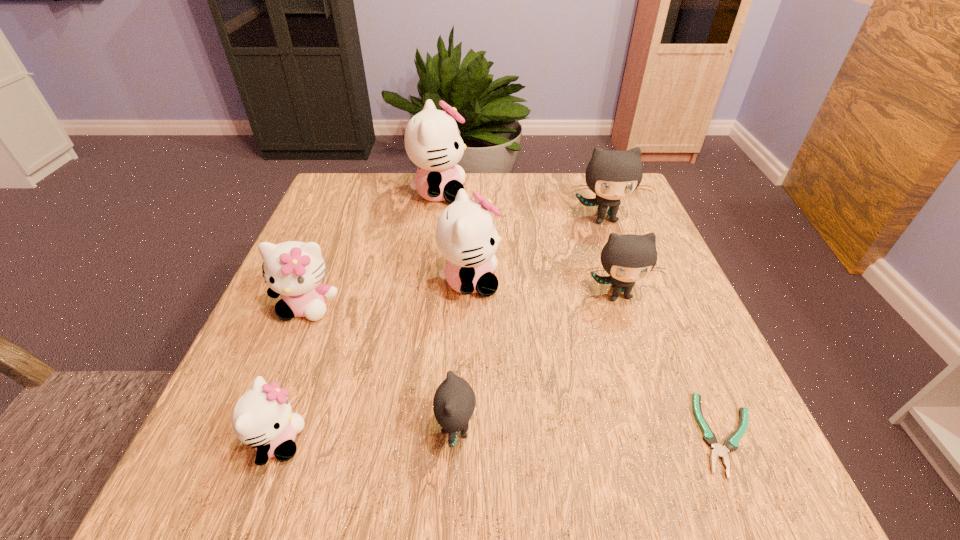
Where is `white kitten object that ranks as the closest to the third biggest white kitten`? The width and height of the screenshot is (960, 540). white kitten object that ranks as the closest to the third biggest white kitten is located at coordinates (262, 417).

The width and height of the screenshot is (960, 540). What are the coordinates of `the closest white kitten relative to the nearest white kitten` in the screenshot? It's located at (294, 269).

Locate an element on the screen. gray kitten that is the closest to the third biggest white kitten is located at coordinates (454, 402).

Identify which gray kitten is the nearest to the teal pliers. Please provide its 2D coordinates. Your answer should be formatted as a tuple, i.e. [(x, y)], where the tuple contains the x and y coordinates of a point satisfying the conditions above.

[(627, 258)]

This screenshot has height=540, width=960. Identify the location of free space that satisfies the following two spatial constraints: 1. on the front-facing side of the biggest gray kitten; 2. on the right side of the shortest object. [683, 434].

Find the location of `free point that satisfies the following two spatial constraints: 1. on the front-facing side of the farthest gray kitten; 2. on the front-facing side of the second biggest white kitten`. free point that satisfies the following two spatial constraints: 1. on the front-facing side of the farthest gray kitten; 2. on the front-facing side of the second biggest white kitten is located at coordinates (627, 281).

Locate an element on the screen. The height and width of the screenshot is (540, 960). free point that satisfies the following two spatial constraints: 1. on the back side of the shortest object; 2. on the front-facing side of the nearest gray kitten is located at coordinates (725, 430).

At what (x,y) coordinates should I click in order to perform the action: click on vacant region that satisfies the following two spatial constraints: 1. on the front-facing side of the biggest gray kitten; 2. on the front-facing side of the second biggest white kitten. Please return your answer as a coordinate pair (x, y). The height and width of the screenshot is (540, 960). Looking at the image, I should click on (627, 281).